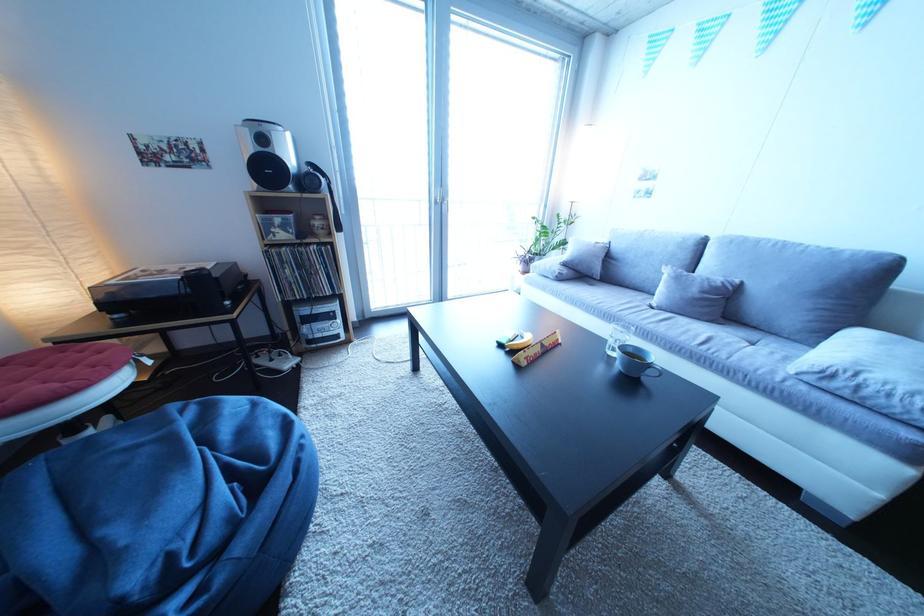
Locate an element on the screen. The width and height of the screenshot is (924, 616). red floor cushion is located at coordinates (55, 373).